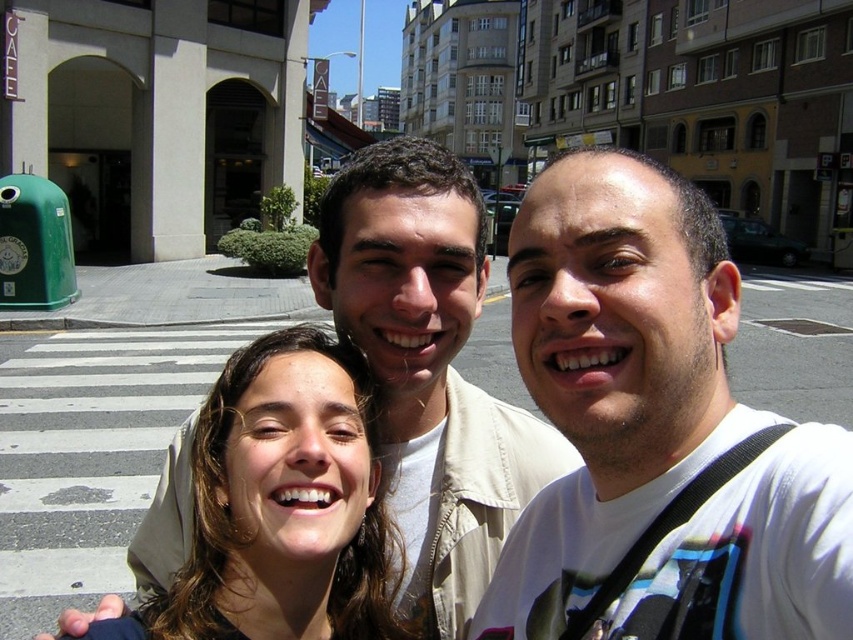
Looking at this image, is white matte shirt at center bigger than brown hair at center?

Yes.

Between point (662, 632) and point (263, 381), which one is positioned behind?

Point (263, 381)

Identify the location of white matte shirt at center. (656, 428).